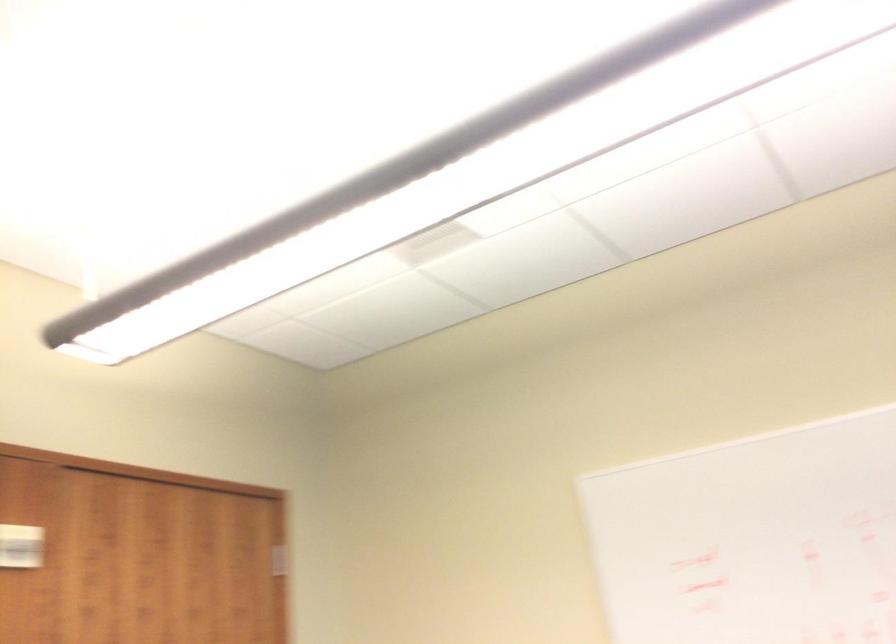
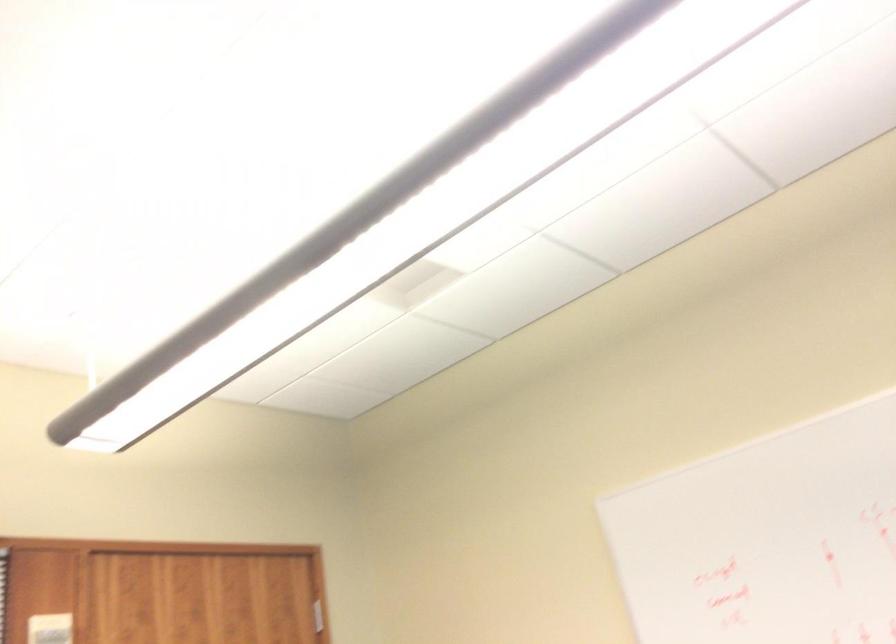
Question: The camera is either moving clockwise (left) or counter-clockwise (right) around the object. The first image is from the beginning of the video and the second image is from the end. Is the camera moving left or right when shooting the video?

Choices:
 (A) Left
 (B) Right

Answer: (B)